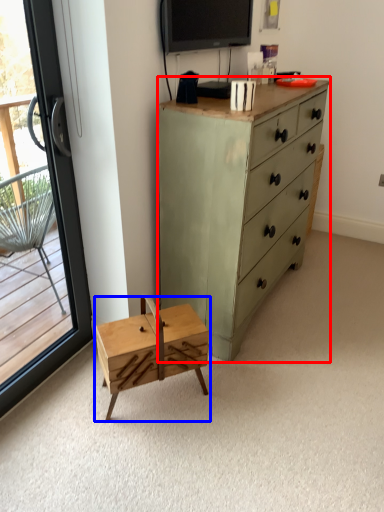
Question: Among these objects, which one is nearest to the camera, chest of drawers (highlighted by a red box) or changing table (highlighted by a blue box)?

Choices:
 (A) chest of drawers
 (B) changing table

Answer: (A)